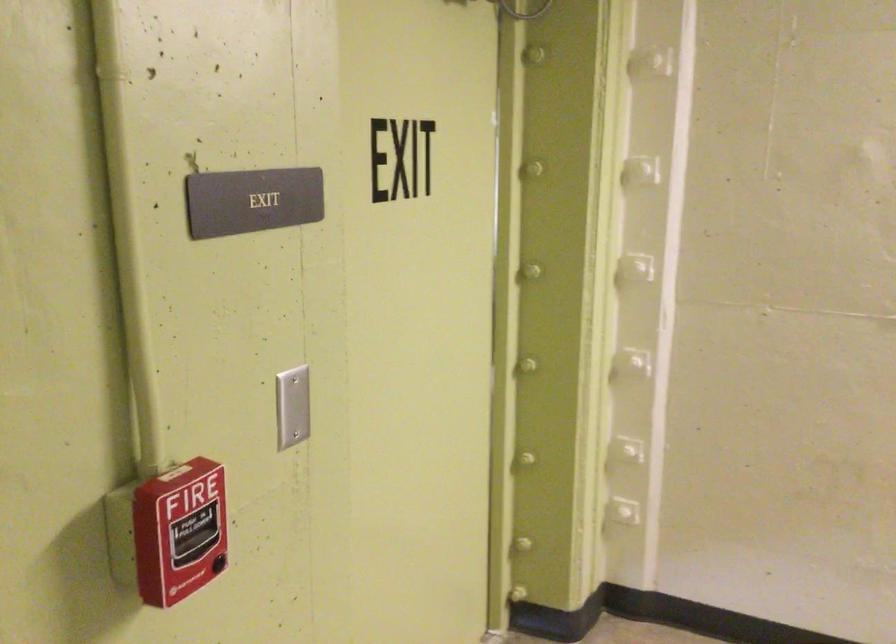
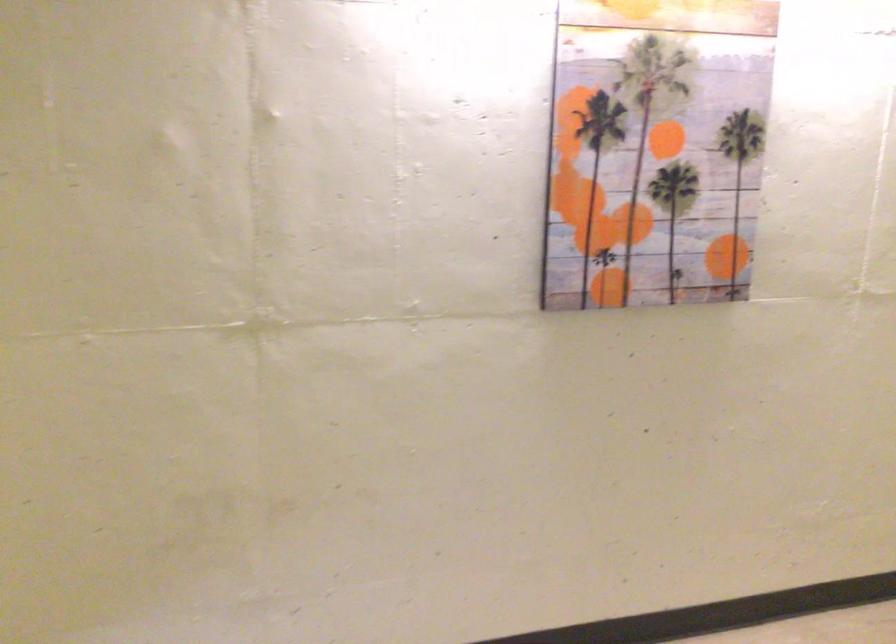
Question: The camera is either moving clockwise (left) or counter-clockwise (right) around the object. The first image is from the beginning of the video and the second image is from the end. Is the camera moving left or right when shooting the video?

Choices:
 (A) Left
 (B) Right

Answer: (A)